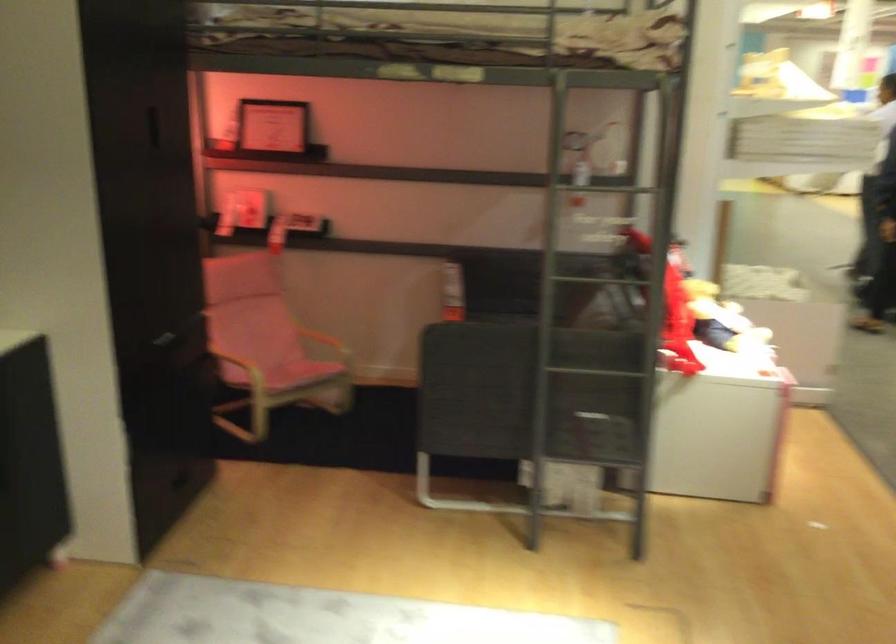
Image resolution: width=896 pixels, height=644 pixels. Describe the element at coordinates (272, 126) in the screenshot. I see `the black framed picture` at that location.